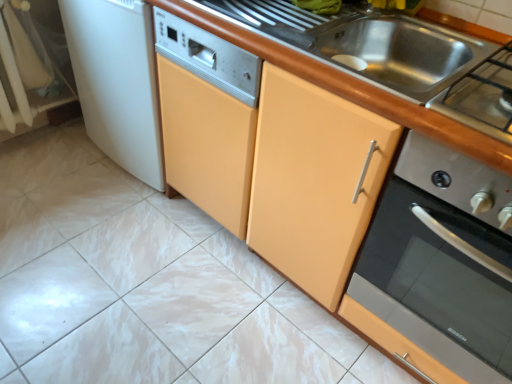
Describe the element at coordinates (359, 44) in the screenshot. I see `metallic stainless steel sink at upper center` at that location.

Locate an element on the screen. wooden at center is located at coordinates (349, 91).

Locate an element on the screen. white glossy ceramic tile at center is located at coordinates (145, 285).

The width and height of the screenshot is (512, 384). What do you see at coordinates (443, 260) in the screenshot? I see `stainless steel oven at right, the first home appliance viewed from the right` at bounding box center [443, 260].

Based on the photo, measure the distance between stainless steel oven at right, the 2th home appliance when ordered from left to right, and camera.

The distance of stainless steel oven at right, the 2th home appliance when ordered from left to right, from camera is 31.22 inches.

Measure the distance between stainless steel gas stove at upper right and camera.

The distance of stainless steel gas stove at upper right from camera is 77.50 centimeters.

What do you see at coordinates (482, 96) in the screenshot? The width and height of the screenshot is (512, 384). I see `stainless steel gas stove at upper right` at bounding box center [482, 96].

Locate an element on the screen. The width and height of the screenshot is (512, 384). metallic stainless steel sink at upper center is located at coordinates (359, 44).

You are a GUI agent. You are given a task and a screenshot of the screen. Output one action in this format:
    pyautogui.click(x=<x>, y=<y>)
    Task: Click on the gas stove on the right of metallic stainless steel sink at upper center
    
    Given the screenshot: What is the action you would take?
    pyautogui.click(x=482, y=96)

Is metallic stainless steel sink at upper center far away from stainless steel gas stove at upper right?

No, metallic stainless steel sink at upper center is not far away from stainless steel gas stove at upper right.

Which object is positioned more to the right, metallic stainless steel sink at upper center or stainless steel gas stove at upper right?

From the viewer's perspective, stainless steel gas stove at upper right appears more on the right side.

Considering the relative sizes of metallic stainless steel sink at upper center and stainless steel gas stove at upper right in the image provided, is metallic stainless steel sink at upper center bigger than stainless steel gas stove at upper right?

Yes.

Considering the points (142, 304) and (106, 86), which point is behind, point (142, 304) or point (106, 86)?

The point (106, 86) is farther.

From a real-world perspective, is white glossy ceramic tile at center above or below white plastic dishwasher at center-left, which is the first home appliance from left to right?

From a real-world perspective, white glossy ceramic tile at center is physically below white plastic dishwasher at center-left, which is the first home appliance from left to right.

Is white glossy ceramic tile at center thinner than white plastic dishwasher at center-left, which is the first home appliance from left to right?

In fact, white glossy ceramic tile at center might be wider than white plastic dishwasher at center-left, which is the first home appliance from left to right.

In terms of height, does white glossy ceramic tile at center look taller or shorter compared to white plastic dishwasher at center-left, arranged as the second home appliance when viewed from the right?

white glossy ceramic tile at center is shorter than white plastic dishwasher at center-left, arranged as the second home appliance when viewed from the right.

At what (x,y) coordinates should I click in order to perform the action: click on counter top on the right of white glossy ceramic tile at center. Please return your answer as a coordinate pair (x, y). The image size is (512, 384). Looking at the image, I should click on (359, 44).

From a real-world perspective, who is located lower, metallic stainless steel sink at upper center or white glossy ceramic tile at center?

white glossy ceramic tile at center is physically lower.

Can you confirm if metallic stainless steel sink at upper center is thinner than white glossy ceramic tile at center?

Yes, metallic stainless steel sink at upper center is thinner than white glossy ceramic tile at center.

From the image's perspective, who appears lower, metallic stainless steel sink at upper center or white glossy ceramic tile at center?

white glossy ceramic tile at center appears lower in the image.

Who is smaller, wooden at center or stainless steel oven at right, the first home appliance viewed from the right?

With smaller size is stainless steel oven at right, the first home appliance viewed from the right.

Could you tell me if wooden at center is facing stainless steel oven at right, the first home appliance viewed from the right?

Yes, wooden at center is turned towards stainless steel oven at right, the first home appliance viewed from the right.

Considering their positions, is wooden at center located in front of or behind stainless steel oven at right, the 2th home appliance when ordered from left to right?

wooden at center is positioned closer to the viewer than stainless steel oven at right, the 2th home appliance when ordered from left to right.

Which is behind, stainless steel oven at right, the first home appliance viewed from the right, or wooden at center?

stainless steel oven at right, the first home appliance viewed from the right.

Does point (489, 183) come closer to viewer compared to point (337, 164)?

Yes, point (489, 183) is in front of point (337, 164).

Considering the positions of objects stainless steel oven at right, the 2th home appliance when ordered from left to right, and wooden at center in the image provided, who is more to the right, stainless steel oven at right, the 2th home appliance when ordered from left to right, or wooden at center?

stainless steel oven at right, the 2th home appliance when ordered from left to right, is more to the right.

From a real-world perspective, is stainless steel oven at right, the 2th home appliance when ordered from left to right, positioned under wooden at center based on gravity?

No, from a real-world perspective, stainless steel oven at right, the 2th home appliance when ordered from left to right, is not below wooden at center.

From the image's perspective, relative to stainless steel oven at right, the first home appliance viewed from the right, is white plastic dishwasher at center-left, arranged as the second home appliance when viewed from the right, above or below?

From the image's perspective, white plastic dishwasher at center-left, arranged as the second home appliance when viewed from the right, appears above stainless steel oven at right, the first home appliance viewed from the right.

Would you consider white plastic dishwasher at center-left, which is the first home appliance from left to right, to be distant from stainless steel oven at right, the 2th home appliance when ordered from left to right?

white plastic dishwasher at center-left, which is the first home appliance from left to right, is far away from stainless steel oven at right, the 2th home appliance when ordered from left to right.

Consider the image. Who is taller, white plastic dishwasher at center-left, which is the first home appliance from left to right, or stainless steel oven at right, the first home appliance viewed from the right?

Standing taller between the two is white plastic dishwasher at center-left, which is the first home appliance from left to right.

Does metallic stainless steel sink at upper center appear on the left side of stainless steel oven at right, the first home appliance viewed from the right?

Yes, metallic stainless steel sink at upper center is to the left of stainless steel oven at right, the first home appliance viewed from the right.

From a real-world perspective, which is physically below, metallic stainless steel sink at upper center or stainless steel oven at right, the 2th home appliance when ordered from left to right?

From a 3D spatial view, stainless steel oven at right, the 2th home appliance when ordered from left to right, is below.

In terms of height, does metallic stainless steel sink at upper center look taller or shorter compared to stainless steel oven at right, the first home appliance viewed from the right?

In the image, metallic stainless steel sink at upper center appears to be shorter than stainless steel oven at right, the first home appliance viewed from the right.

From the image's perspective, is metallic stainless steel sink at upper center above or below stainless steel oven at right, the first home appliance viewed from the right?

metallic stainless steel sink at upper center is situated higher than stainless steel oven at right, the first home appliance viewed from the right, in the image.

At what (x,y) coordinates should I click in order to perform the action: click on gas stove that appears in front of the metallic stainless steel sink at upper center. Please return your answer as a coordinate pair (x, y). Looking at the image, I should click on pos(482,96).

Locate an element on the screen. This screenshot has width=512, height=384. ceramic tile below the white plastic dishwasher at center-left, which is the first home appliance from left to right (from the image's perspective) is located at coordinates (145, 285).

From the picture: Based on their spatial positions, is white glossy ceramic tile at center or stainless steel gas stove at upper right closer to metallic stainless steel sink at upper center?

Based on the image, stainless steel gas stove at upper right appears to be nearer to metallic stainless steel sink at upper center.

From the image, which object appears to be farther from stainless steel oven at right, the 2th home appliance when ordered from left to right, wooden at center or white glossy ceramic tile at center?

Among the two, white glossy ceramic tile at center is located further to stainless steel oven at right, the 2th home appliance when ordered from left to right.

Looking at the image, which one is located closer to white glossy ceramic tile at center, metallic stainless steel sink at upper center or wooden at center?

wooden at center.

When comparing their distances from metallic stainless steel sink at upper center, does white glossy ceramic tile at center or stainless steel oven at right, the 2th home appliance when ordered from left to right, seem further?

white glossy ceramic tile at center.

When comparing their distances from white glossy ceramic tile at center, does stainless steel gas stove at upper right or metallic stainless steel sink at upper center seem further?

stainless steel gas stove at upper right is positioned further to the anchor white glossy ceramic tile at center.

Based on their spatial positions, is stainless steel gas stove at upper right or white plastic dishwasher at center-left, arranged as the second home appliance when viewed from the right, further from metallic stainless steel sink at upper center?

Based on the image, white plastic dishwasher at center-left, arranged as the second home appliance when viewed from the right, appears to be further to metallic stainless steel sink at upper center.

Which object lies nearer to the anchor point wooden at center, stainless steel gas stove at upper right or stainless steel oven at right, the 2th home appliance when ordered from left to right?

Among the two, stainless steel oven at right, the 2th home appliance when ordered from left to right, is located nearer to wooden at center.

Estimate the real-world distances between objects in this image. Which object is further from wooden at center, stainless steel oven at right, the 2th home appliance when ordered from left to right, or stainless steel gas stove at upper right?

stainless steel gas stove at upper right.

Locate an element on the screen. This screenshot has width=512, height=384. counter top between white glossy ceramic tile at center and stainless steel gas stove at upper right is located at coordinates click(x=359, y=44).

What are the coordinates of `countertop between metallic stainless steel sink at upper center and stainless steel gas stove at upper right in the horizontal direction` in the screenshot? It's located at (349, 91).

I want to click on counter top that lies between white plastic dishwasher at center-left, which is the first home appliance from left to right, and white glossy ceramic tile at center from top to bottom, so click(x=359, y=44).

The width and height of the screenshot is (512, 384). Find the location of `countertop situated between white plastic dishwasher at center-left, which is the first home appliance from left to right, and stainless steel gas stove at upper right from left to right`. countertop situated between white plastic dishwasher at center-left, which is the first home appliance from left to right, and stainless steel gas stove at upper right from left to right is located at coordinates (349, 91).